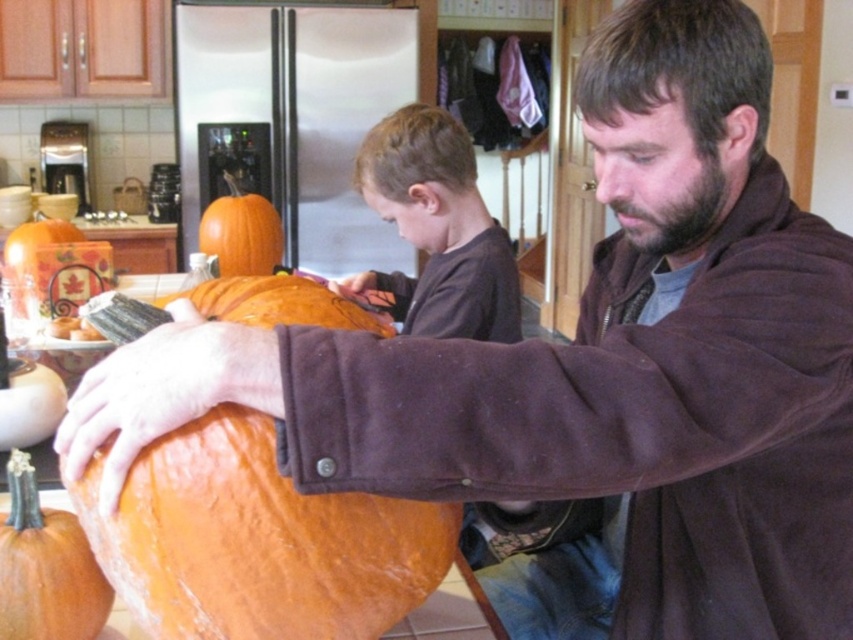
Does orange matte pumpkin at center have a greater height compared to orange matte pumpkin at lower left?

Correct, orange matte pumpkin at center is much taller as orange matte pumpkin at lower left.

Which of these two, orange matte pumpkin at center or orange matte pumpkin at lower left, stands taller?

With more height is orange matte pumpkin at center.

Does point (395, 516) come behind point (16, 548)?

No.

Find the location of a particular element. The image size is (853, 640). orange matte pumpkin at center is located at coordinates (257, 541).

Can you confirm if smooth orange pumpkin at center is positioned below orange matte pumpkin at upper center?

Correct, smooth orange pumpkin at center is located below orange matte pumpkin at upper center.

Between point (395, 224) and point (219, 224), which one is positioned in front?

Point (219, 224) is in front.

Who is more forward, (390, 186) or (242, 204)?

Point (390, 186)

Where is `smooth orange pumpkin at center`? smooth orange pumpkin at center is located at coordinates (437, 228).

Does point (486, 224) come closer to viewer compared to point (4, 515)?

No.

At what (x,y) coordinates should I click in order to perform the action: click on smooth orange pumpkin at center. Please return your answer as a coordinate pair (x, y). This screenshot has height=640, width=853. Looking at the image, I should click on (437, 228).

Does point (450, 204) come farther from viewer compared to point (15, 451)?

Yes.

This screenshot has width=853, height=640. Find the location of `smooth orange pumpkin at center`. smooth orange pumpkin at center is located at coordinates click(437, 228).